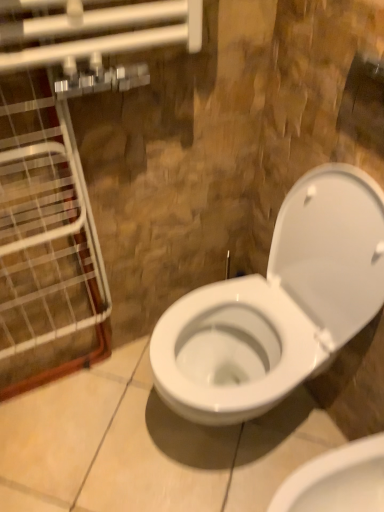
This screenshot has width=384, height=512. Identify the location of vacant space that's between white glossy toilet at center, the second toilet from the bottom, and clear glass door at left. (110, 426).